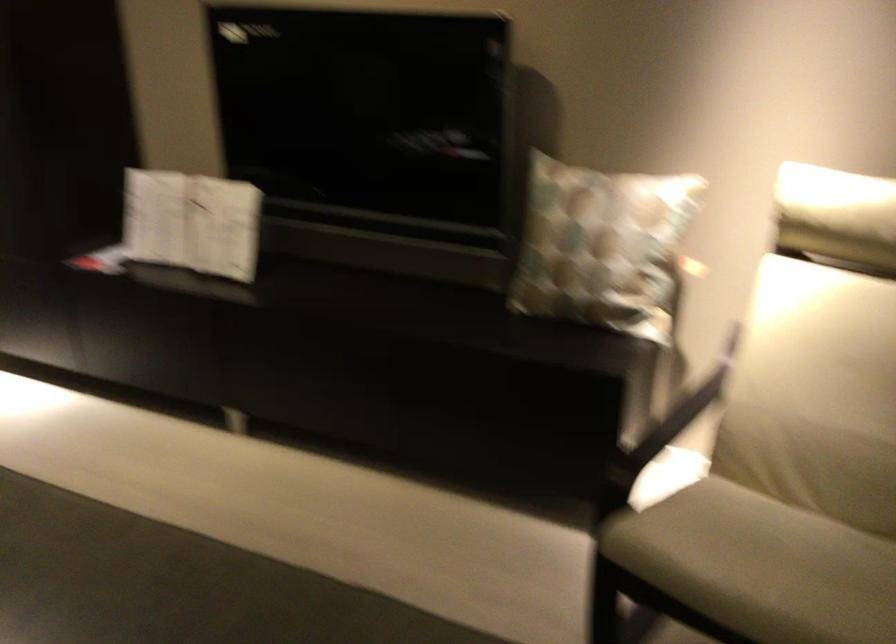
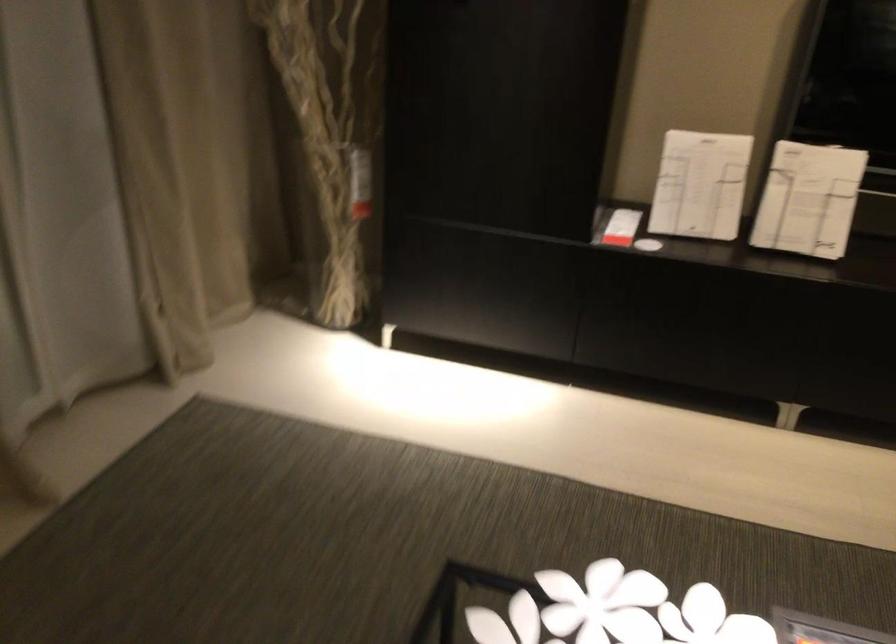
Locate, in the second image, the point that corresponds to (217,232) in the first image.

(808, 200)